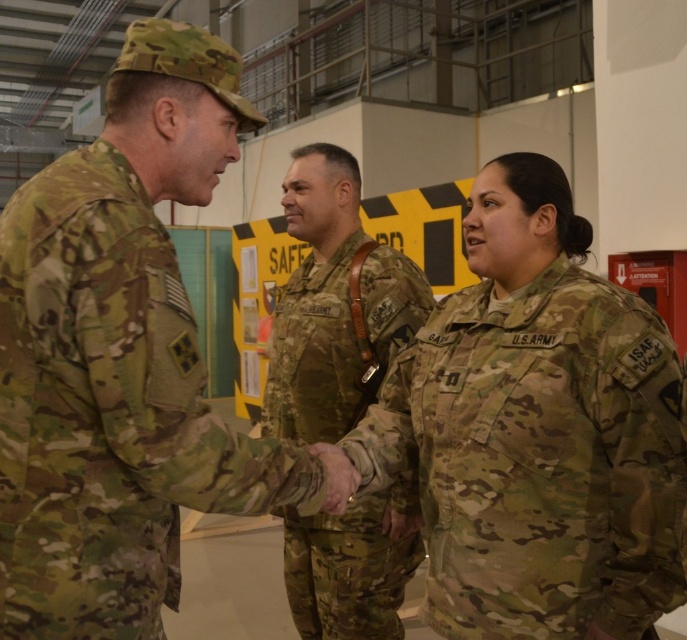
Question: Which point is farther to the camera?

Choices:
 (A) (416, 285)
 (B) (177, 483)
 (C) (598, 394)

Answer: (A)

Question: Based on their relative distances, which object is nearer to the camo fabric uniform at center?

Choices:
 (A) camouflage fabric uniform at left
 (B) camouflage fabric uniform at center

Answer: (B)

Question: Can you confirm if camo fabric uniform at center is positioned to the left of camouflage fabric uniform at center?

Choices:
 (A) no
 (B) yes

Answer: (A)

Question: Which of the following is the closest to the observer?

Choices:
 (A) camouflage fabric uniform at center
 (B) camo fabric uniform at center

Answer: (B)

Question: Considering the relative positions of camo fabric uniform at center and camouflage fabric uniform at left in the image provided, where is camo fabric uniform at center located with respect to camouflage fabric uniform at left?

Choices:
 (A) left
 (B) right

Answer: (B)

Question: Observing the image, what is the correct spatial positioning of camo fabric uniform at center in reference to camouflage fabric uniform at left?

Choices:
 (A) left
 (B) right

Answer: (B)